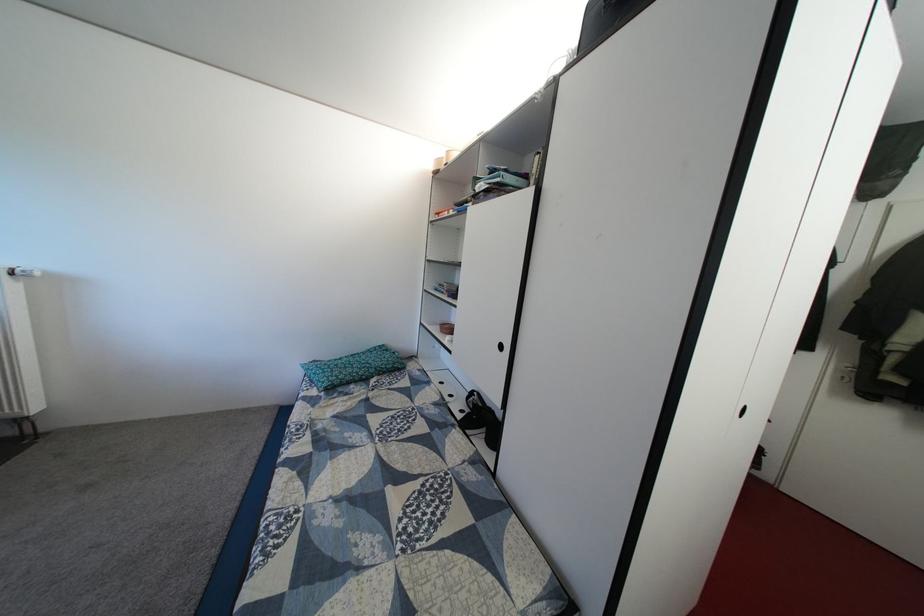
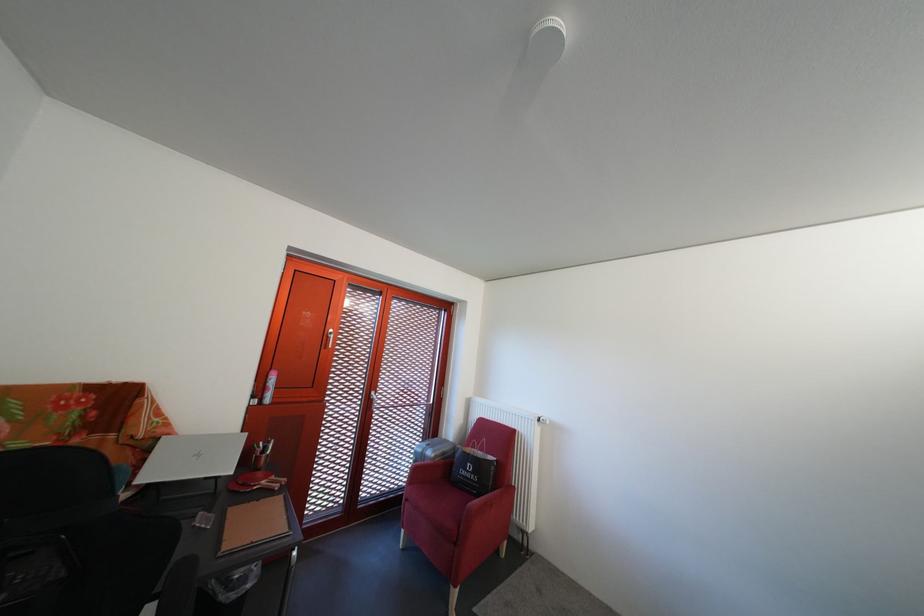
How did the camera likely rotate?

The camera rotated toward left-up.